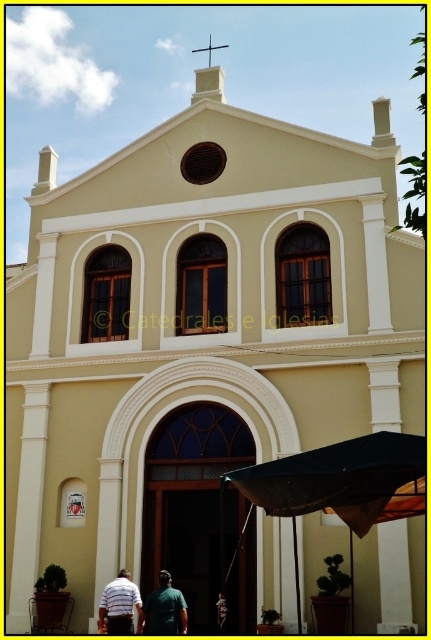
Question: Is dark fabric umbrella at lower center to the right of striped shirt at lower center from the viewer's perspective?

Choices:
 (A) no
 (B) yes

Answer: (B)

Question: Which point is farther to the camera?

Choices:
 (A) green matte shirt at lower center
 (B) dark fabric umbrella at lower center

Answer: (A)

Question: Is dark fabric umbrella at lower center to the right of green matte shirt at lower center from the viewer's perspective?

Choices:
 (A) yes
 (B) no

Answer: (A)

Question: Which is farther from the striped shirt at lower center?

Choices:
 (A) green matte shirt at lower center
 (B) dark fabric umbrella at lower center

Answer: (B)

Question: Which point is farther to the camera?

Choices:
 (A) (146, 618)
 (B) (299, 593)
 (C) (97, 621)

Answer: (C)

Question: Does dark fabric umbrella at lower center come behind green matte shirt at lower center?

Choices:
 (A) yes
 (B) no

Answer: (B)